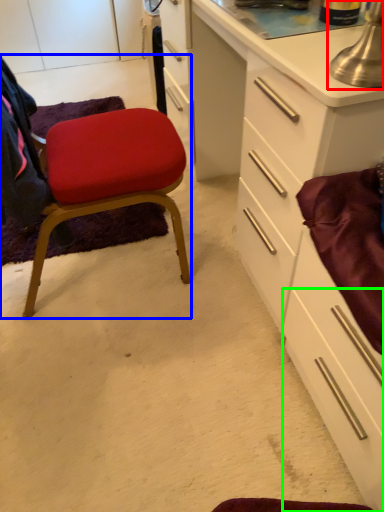
Question: Considering the real-world distances, which object is closest to table lamp (highlighted by a red box)? chair (highlighted by a blue box) or drawer (highlighted by a green box).

Choices:
 (A) chair
 (B) drawer

Answer: (B)